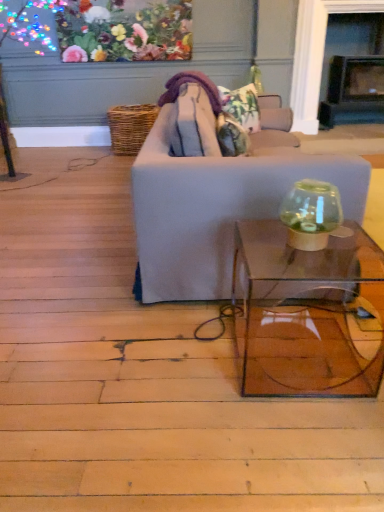
Question: From a real-world perspective, relative to floral fabric pillow at center, is transparent glass table at center vertically above or below?

Choices:
 (A) below
 (B) above

Answer: (A)

Question: Does point (251, 343) appear closer or farther from the camera than point (251, 111)?

Choices:
 (A) closer
 (B) farther

Answer: (A)

Question: Which of these objects is positioned farthest from the floral print fabric at upper center?

Choices:
 (A) light gray fabric couch at center
 (B) transparent glass fishbowl at right
 (C) floral fabric pillow at center
 (D) transparent glass table at center

Answer: (D)

Question: Which is nearer to the floral print fabric at upper center?

Choices:
 (A) floral fabric pillow at center
 (B) transparent glass fishbowl at right
 (C) transparent glass table at center
 (D) light gray fabric couch at center

Answer: (A)